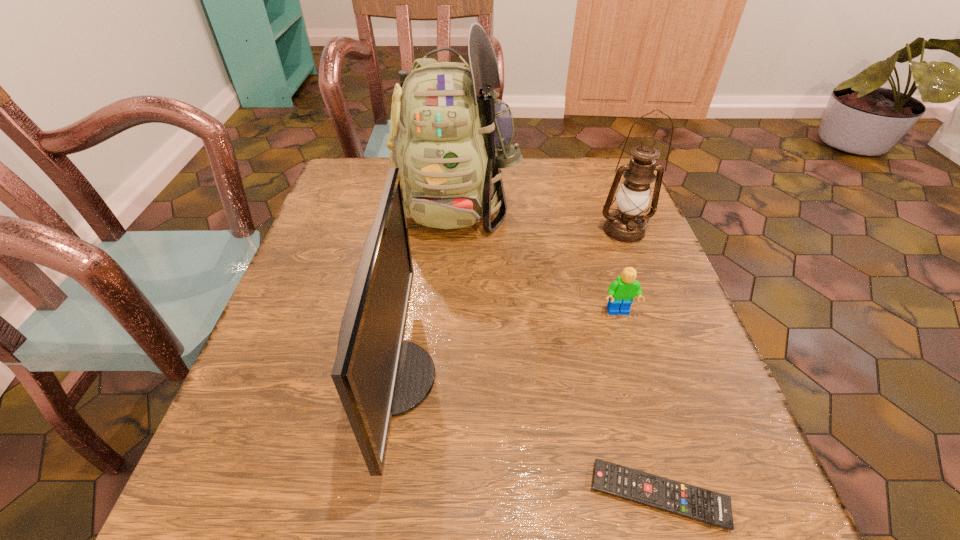
The height and width of the screenshot is (540, 960). I want to click on object located in the far edge section of the desktop, so coord(450,137).

The width and height of the screenshot is (960, 540). What are the coordinates of `monitor that is at the near edge` in the screenshot? It's located at (378, 375).

Find the location of a particular element. Image resolution: width=960 pixels, height=540 pixels. remote control located at the near edge is located at coordinates (706, 506).

The width and height of the screenshot is (960, 540). In order to click on object that is at the left edge in this screenshot , I will do `click(378, 375)`.

The height and width of the screenshot is (540, 960). In order to click on oil lamp that is at the right edge in this screenshot , I will do `click(625, 225)`.

Find the location of `Lego located in the right edge section of the desktop`. Lego located in the right edge section of the desktop is located at coordinates (621, 292).

You are a GUI agent. You are given a task and a screenshot of the screen. Output one action in this format:
    pyautogui.click(x=<x>, y=<y>)
    Task: Click on the remote control that is positioned at the right edge
    The image size is (960, 540).
    Given the screenshot: What is the action you would take?
    pyautogui.click(x=706, y=506)

You are a GUI agent. You are given a task and a screenshot of the screen. Output one action in this format:
    pyautogui.click(x=<x>, y=<y>)
    Task: Click on the object at the near left corner
    This screenshot has height=540, width=960.
    Given the screenshot: What is the action you would take?
    pyautogui.click(x=378, y=375)

The height and width of the screenshot is (540, 960). What are the coordinates of `object located in the near right corner section of the desktop` in the screenshot? It's located at (706, 506).

Where is `vacant area at the far edge`? vacant area at the far edge is located at coordinates (528, 172).